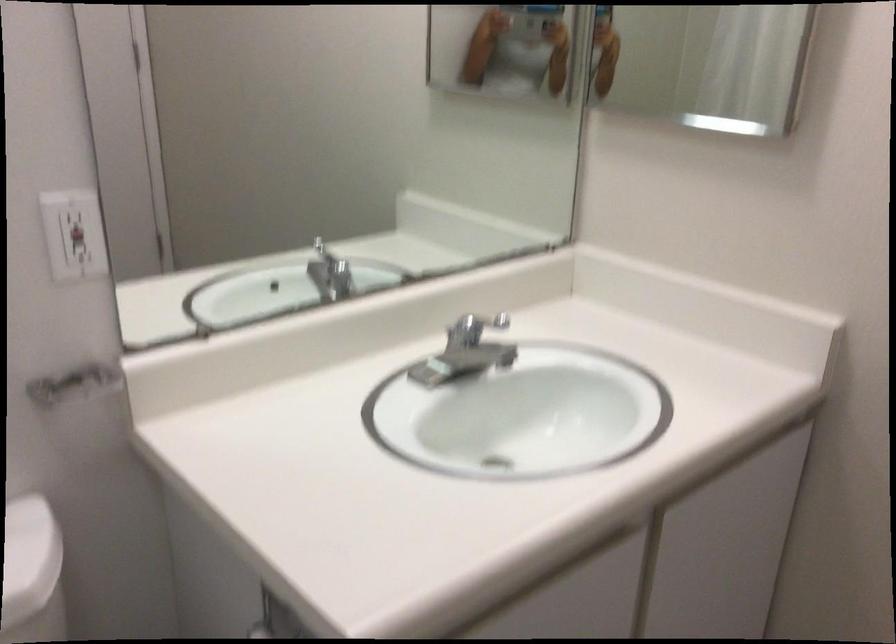
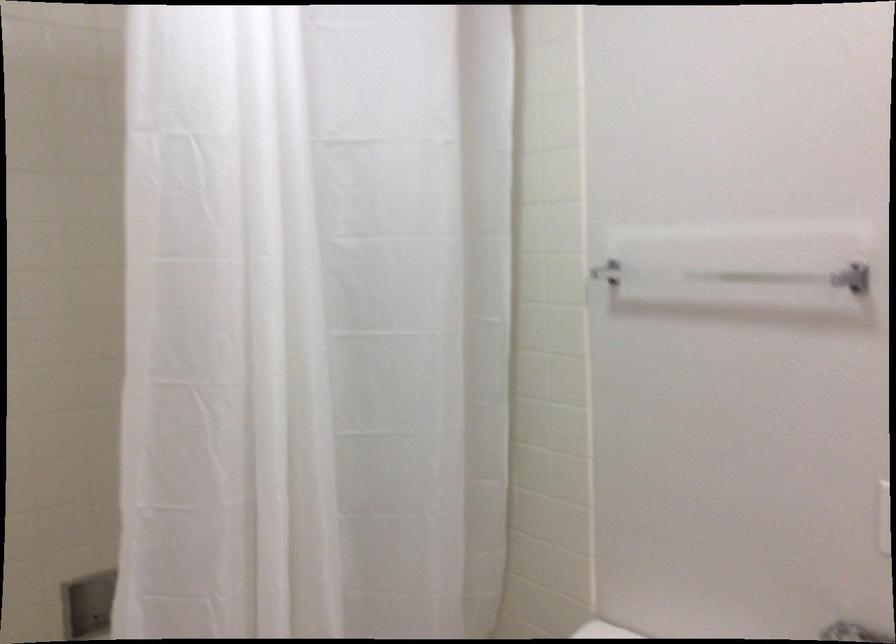
Question: The camera is either moving clockwise (left) or counter-clockwise (right) around the object. The first image is from the beginning of the video and the second image is from the end. Is the camera moving left or right when shooting the video?

Choices:
 (A) Left
 (B) Right

Answer: (B)